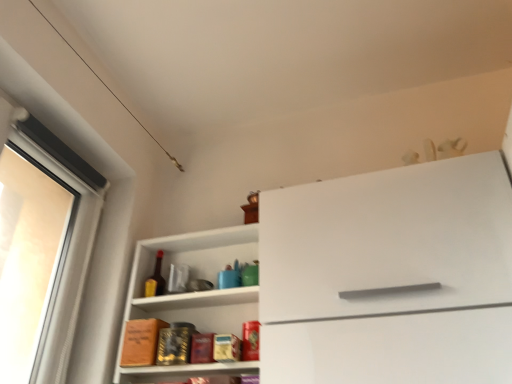
What do you see at coordinates (197, 276) in the screenshot? I see `white glossy shelf at center` at bounding box center [197, 276].

Where is `white glossy shelf at center`? This screenshot has width=512, height=384. white glossy shelf at center is located at coordinates (197, 276).

Is white matte cabinet at center positioned far away from matte glass bottle at center?

They are positioned close to each other.

Is white matte cabinet at center located outside matte glass bottle at center?

Yes, white matte cabinet at center is located beyond the bounds of matte glass bottle at center.

What's the angular difference between white matte cabinet at center and matte glass bottle at center's facing directions?

white matte cabinet at center and matte glass bottle at center are facing 1.61 degrees away from each other.

From the image's perspective, is white matte cabinet at center located above matte glass bottle at center?

Indeed, from the image's perspective, white matte cabinet at center is shown above matte glass bottle at center.

Is white matte cabinet at center in front of or behind white glossy shelf at center in the image?

white matte cabinet at center is positioned closer to the viewer than white glossy shelf at center.

Looking at this image, can you confirm if white matte cabinet at center is positioned to the left of white glossy shelf at center?

No.

Considering the relative sizes of white matte cabinet at center and white glossy shelf at center in the image provided, is white matte cabinet at center shorter than white glossy shelf at center?

No.

In the scene shown: Is white matte cabinet at center wider or thinner than white glossy shelf at center?

white matte cabinet at center is wider than white glossy shelf at center.

From the image's perspective, is matte glass bottle at center located above or below white matte cabinet at center?

matte glass bottle at center is situated lower than white matte cabinet at center in the image.

Does matte glass bottle at center touch white matte cabinet at center?

No, matte glass bottle at center is not in contact with white matte cabinet at center.

From the image's perspective, does matte glass bottle at center appear higher than white glossy shelf at center?

Yes, from the image's perspective, matte glass bottle at center is over white glossy shelf at center.

Is matte glass bottle at center positioned beyond the bounds of white glossy shelf at center?

Actually, matte glass bottle at center is at least partially inside white glossy shelf at center.

Between matte glass bottle at center and white glossy shelf at center, which one has less height?

A: matte glass bottle at center is shorter.

Which point is more forward, (157, 271) or (249, 315)?

Positioned in front is point (249, 315).

From the image's perspective, between white glossy shelf at center and matte glass bottle at center, which one is located above?

matte glass bottle at center.

Is white glossy shelf at center looking in the opposite direction of matte glass bottle at center?

Yes, white glossy shelf at center is facing away from matte glass bottle at center.

I want to click on shelf below the matte glass bottle at center (from the image's perspective), so click(197, 276).

Does white glossy shelf at center have a smaller size compared to matte glass bottle at center?

Actually, white glossy shelf at center might be larger than matte glass bottle at center.

From the image's perspective, is white glossy shelf at center under white matte cabinet at center?

Yes, from the image's perspective, white glossy shelf at center is beneath white matte cabinet at center.

Is there a large distance between white glossy shelf at center and white matte cabinet at center?

Actually, white glossy shelf at center and white matte cabinet at center are a little close together.

Which of these two, white glossy shelf at center or white matte cabinet at center, is bigger?

With larger size is white matte cabinet at center.

In the image, there is a white glossy shelf at center. At what (x,y) coordinates should I click in order to perform the action: click on cabinetry below it (from a real-world perspective). Please return your answer as a coordinate pair (x, y). Looking at the image, I should click on (390, 277).

At what (x,y) coordinates should I click in order to perform the action: click on bottle above the white matte cabinet at center (from a real-world perspective). Please return your answer as a coordinate pair (x, y). Looking at the image, I should click on (156, 279).

Locate an element on the screen. shelf on the left of white matte cabinet at center is located at coordinates (197, 276).

Consider the image. Based on their spatial positions, is white matte cabinet at center or white glossy shelf at center further from matte glass bottle at center?

Among the two, white matte cabinet at center is located further to matte glass bottle at center.

Which object lies nearer to the anchor point white matte cabinet at center, matte glass bottle at center or white glossy shelf at center?

Among the two, white glossy shelf at center is located nearer to white matte cabinet at center.

When comparing their distances from white glossy shelf at center, does white matte cabinet at center or matte glass bottle at center seem further?

Among the two, white matte cabinet at center is located further to white glossy shelf at center.

Estimate the real-world distances between objects in this image. Which object is closer to white glossy shelf at center, matte glass bottle at center or white matte cabinet at center?

matte glass bottle at center.

When comparing their distances from matte glass bottle at center, does white glossy shelf at center or white matte cabinet at center seem closer?

white glossy shelf at center lies closer to matte glass bottle at center than the other object.

From the image, which object appears to be nearer to white matte cabinet at center, white glossy shelf at center or matte glass bottle at center?

white glossy shelf at center is closer to white matte cabinet at center.

At what (x,y) coordinates should I click in order to perform the action: click on shelf located between matte glass bottle at center and white matte cabinet at center in the left-right direction. Please return your answer as a coordinate pair (x, y). The height and width of the screenshot is (384, 512). Looking at the image, I should click on (197, 276).